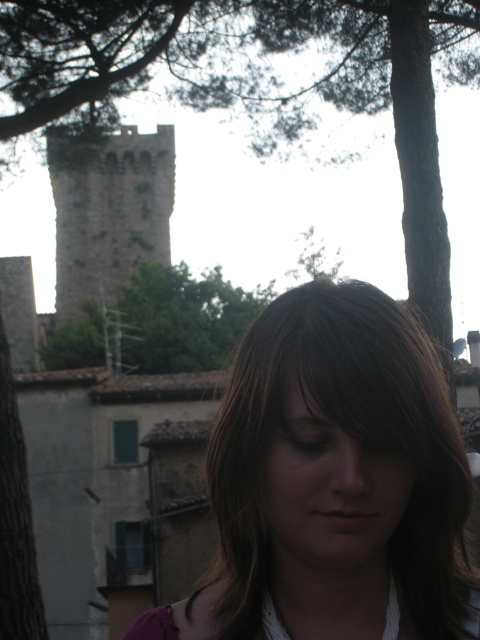
Measure the distance between point [348,77] and camera.

Point [348,77] and camera are 327.16 feet apart.

Can you confirm if green leafy tree at upper center is bigger than stone tower at upper left?

Yes.

The image size is (480, 640). Describe the element at coordinates (262, 83) in the screenshot. I see `green leafy tree at upper center` at that location.

You are a GUI agent. You are given a task and a screenshot of the screen. Output one action in this format:
    pyautogui.click(x=<x>, y=<y>)
    Task: Click on the green leafy tree at upper center
    
    Given the screenshot: What is the action you would take?
    pyautogui.click(x=262, y=83)

Based on the photo, is brown hair at center bigger than green leafy tree at upper center?

No, brown hair at center is not bigger than green leafy tree at upper center.

Is point (380, 529) positioned after point (276, 104)?

No, (380, 529) is in front of (276, 104).

In order to click on brown hair at center in this screenshot , I will do `click(333, 481)`.

Does stone tower at upper left have a smaller size compared to green leafy tree at center?

No, stone tower at upper left is not smaller than green leafy tree at center.

In the scene shown: Can you confirm if stone tower at upper left is positioned to the right of green leafy tree at center?

Incorrect, stone tower at upper left is not on the right side of green leafy tree at center.

The width and height of the screenshot is (480, 640). I want to click on stone tower at upper left, so click(x=108, y=209).

Locate an element on the screen. stone tower at upper left is located at coordinates (108, 209).